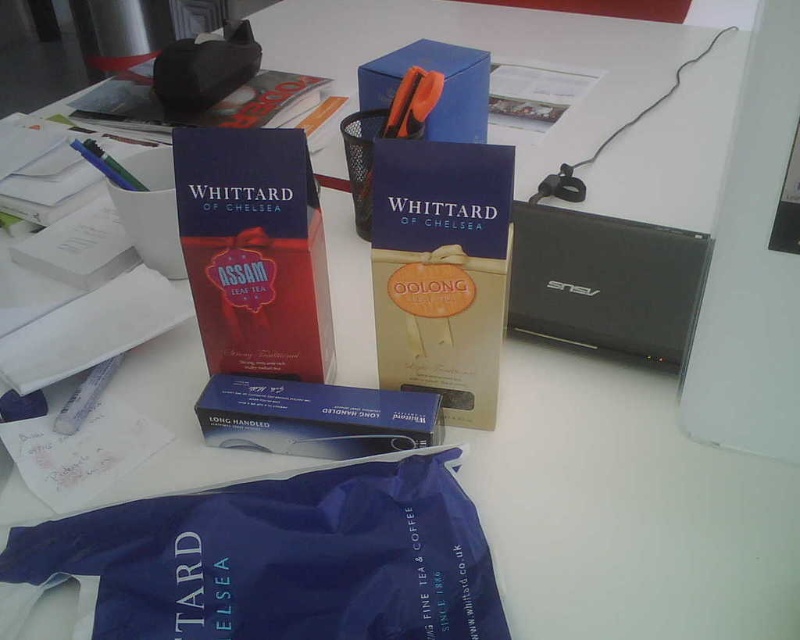
Question: Is matte paper box at center smaller than blue cardboard box at upper center?

Choices:
 (A) yes
 (B) no

Answer: (A)

Question: Which point is closer to the camera taking this photo?

Choices:
 (A) (244, 266)
 (B) (476, 84)
 (C) (260, 516)

Answer: (C)

Question: Can you confirm if matte black tissue box at upper left is positioned to the right of white paper at lower left?

Choices:
 (A) yes
 (B) no

Answer: (B)

Question: Can you confirm if matte paper box at center is positioned to the right of black matte book at upper left?

Choices:
 (A) yes
 (B) no

Answer: (A)

Question: Which is farther from the matte paper box at center?

Choices:
 (A) black matte book at upper left
 (B) blue fabric bag at lower center
 (C) black matte laptop at right
 (D) blue cardboard box at upper center

Answer: (A)

Question: Estimate the real-world distances between objects in this image. Which object is closer to the matte black tissue box at upper left?

Choices:
 (A) blue fabric bag at lower center
 (B) black matte laptop at right

Answer: (B)